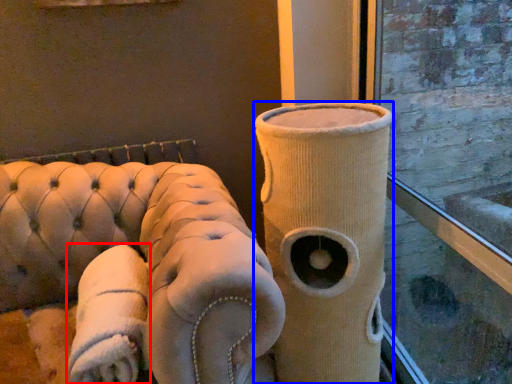
Question: Which object appears farthest to the camera in this image, cloth (highlighted by a red box) or vase (highlighted by a blue box)?

Choices:
 (A) cloth
 (B) vase

Answer: (B)